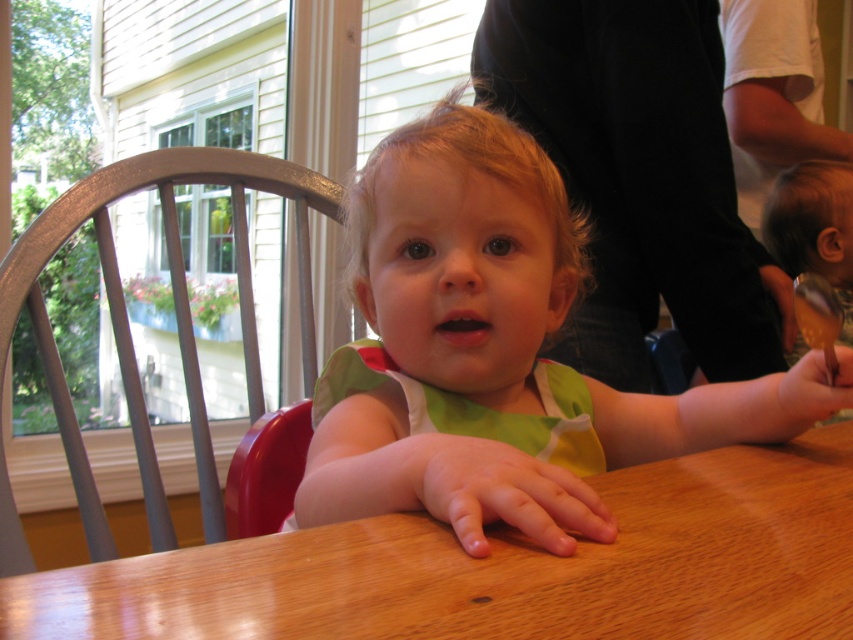
Question: Observing the image, what is the correct spatial positioning of green cotton bib at center in reference to wooden table at center?

Choices:
 (A) below
 (B) above

Answer: (B)

Question: Which of the following is the closest to the observer?

Choices:
 (A) (848, 419)
 (B) (590, 500)
 (C) (49, 232)
 (D) (511, 378)

Answer: (B)

Question: Which of the following is the closest to the observer?

Choices:
 (A) smooth wooden spoon at lower right
 (B) green cotton bib at center
 (C) metallic silver chair at center
 (D) wooden table at center

Answer: (D)

Question: Which of the following is the closest to the observer?

Choices:
 (A) (804, 355)
 (B) (767, 214)

Answer: (A)

Question: Where is smooth brown spoon at right located in relation to smooth wooden spoon at lower right in the image?

Choices:
 (A) left
 (B) right

Answer: (B)

Question: Is metallic silver chair at center bigger than smooth wooden spoon at lower right?

Choices:
 (A) yes
 (B) no

Answer: (A)